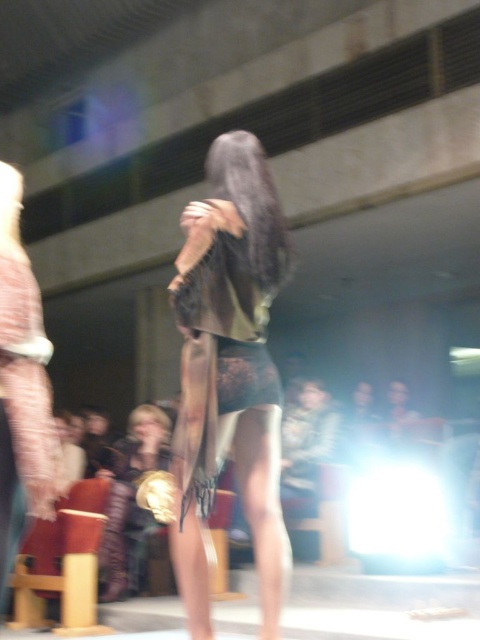
You are a photographer at the fashion show. You need to capture a closeup shot of the shiny metallic dress at center and the shiny gold dress at center. Which dress should you focus on first if you want to ensure the thinner one is in sharp focus?

The shiny metallic dress at center is thinner than the shiny gold dress at center, so you should focus on the shiny metallic dress at center first to ensure it is in sharp focus.